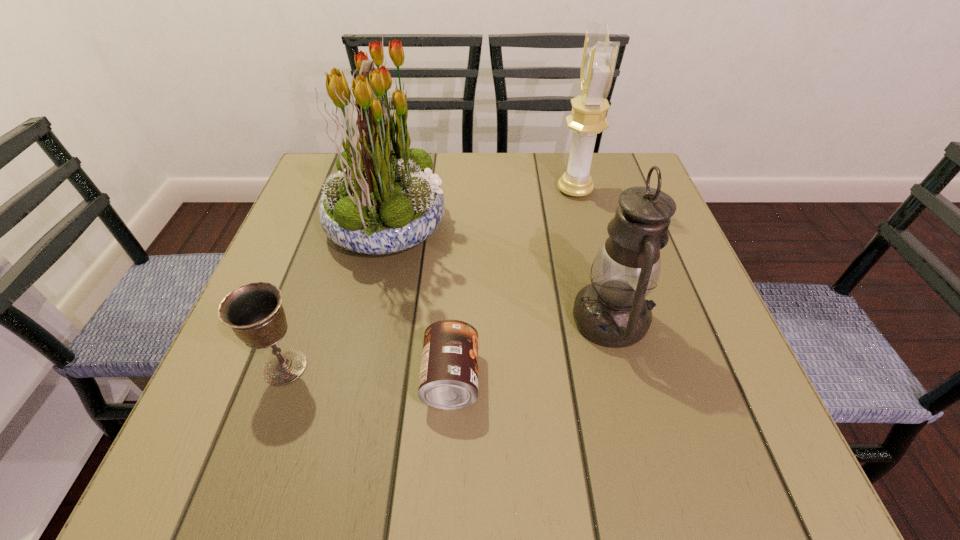
The height and width of the screenshot is (540, 960). Identify the location of free space between the chalice and the flower arrangement. (336, 296).

This screenshot has width=960, height=540. I want to click on free point between the award and the can, so click(513, 285).

The image size is (960, 540). What are the coordinates of `empty space between the shortest object and the award` in the screenshot? It's located at (513, 285).

Find the location of a particular element. empty space between the flower arrangement and the award is located at coordinates (481, 207).

The width and height of the screenshot is (960, 540). What are the coordinates of `free space that is in between the flower arrangement and the award` in the screenshot? It's located at (481, 207).

I want to click on object that is the fourth closest to the oil lamp, so click(x=254, y=312).

Point out which object is positioned as the third nearest to the chalice. Please provide its 2D coordinates. Your answer should be formatted as a tuple, i.e. [(x, y)], where the tuple contains the x and y coordinates of a point satisfying the conditions above.

[(612, 311)]

Image resolution: width=960 pixels, height=540 pixels. I want to click on vacant region that satisfies the following two spatial constraints: 1. on the front side of the oil lamp; 2. on the front label of the can, so click(x=626, y=379).

This screenshot has width=960, height=540. Find the location of `vacant space that satisfies the following two spatial constraints: 1. on the front-facing side of the award; 2. on the back side of the oil lamp`. vacant space that satisfies the following two spatial constraints: 1. on the front-facing side of the award; 2. on the back side of the oil lamp is located at coordinates (609, 320).

This screenshot has height=540, width=960. What are the coordinates of `blank area in the image that satisfies the following two spatial constraints: 1. on the front-facing side of the oil lamp; 2. on the left side of the award` in the screenshot? It's located at (609, 320).